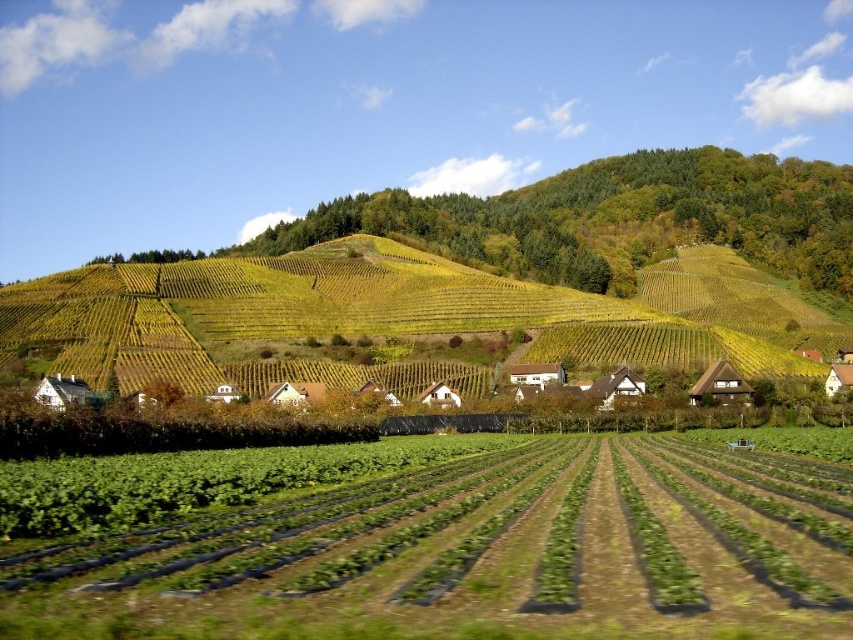
What do you see at coordinates (466, 550) in the screenshot? I see `green plastic field at center` at bounding box center [466, 550].

Is point (154, 536) positioned before point (585, 337)?

Yes, it is in front of point (585, 337).

Image resolution: width=853 pixels, height=640 pixels. I want to click on green plastic field at center, so click(x=466, y=550).